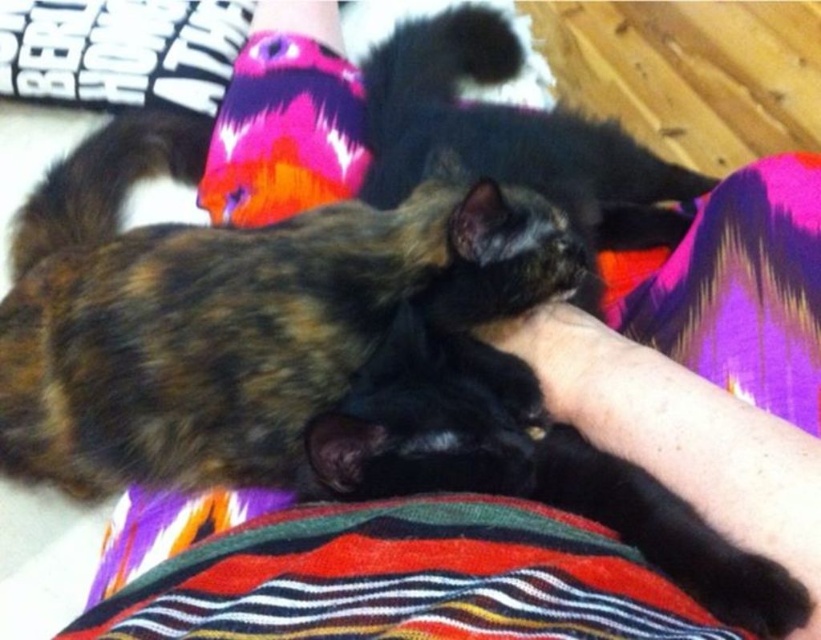
Can you confirm if brown tortoiseshell cat at center is bigger than multicolored knitted sock at upper center?

Correct, brown tortoiseshell cat at center is larger in size than multicolored knitted sock at upper center.

Can you confirm if brown tortoiseshell cat at center is shorter than multicolored knitted sock at upper center?

No.

Image resolution: width=821 pixels, height=640 pixels. In order to click on brown tortoiseshell cat at center in this screenshot , I will do `click(242, 321)`.